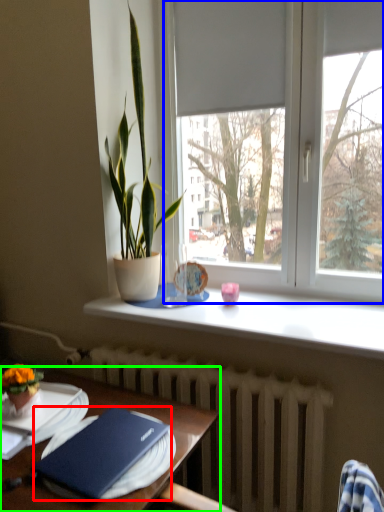
Question: Considering the real-world distances, which object is farthest from hardback book (highlighted by a red box)? window (highlighted by a blue box) or table (highlighted by a green box)?

Choices:
 (A) window
 (B) table

Answer: (A)